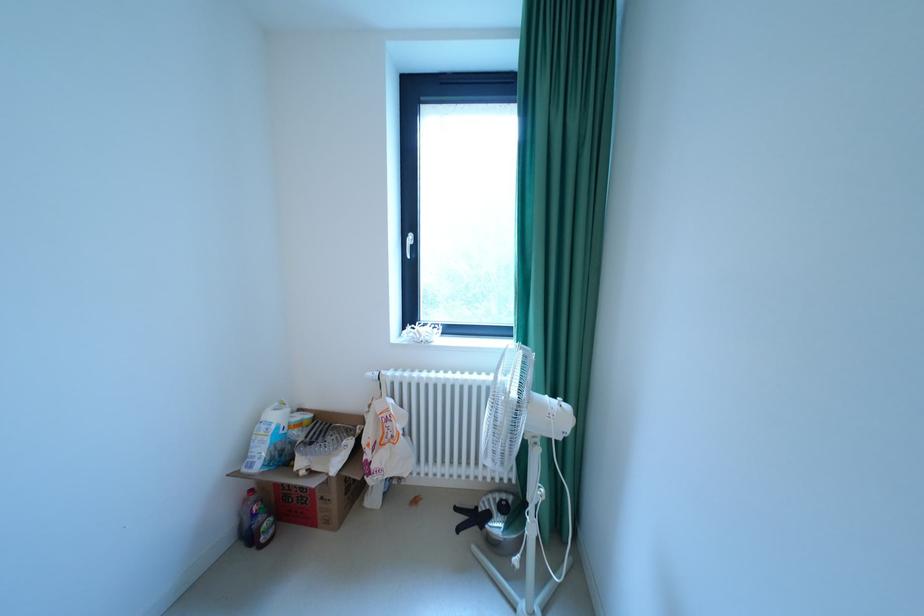
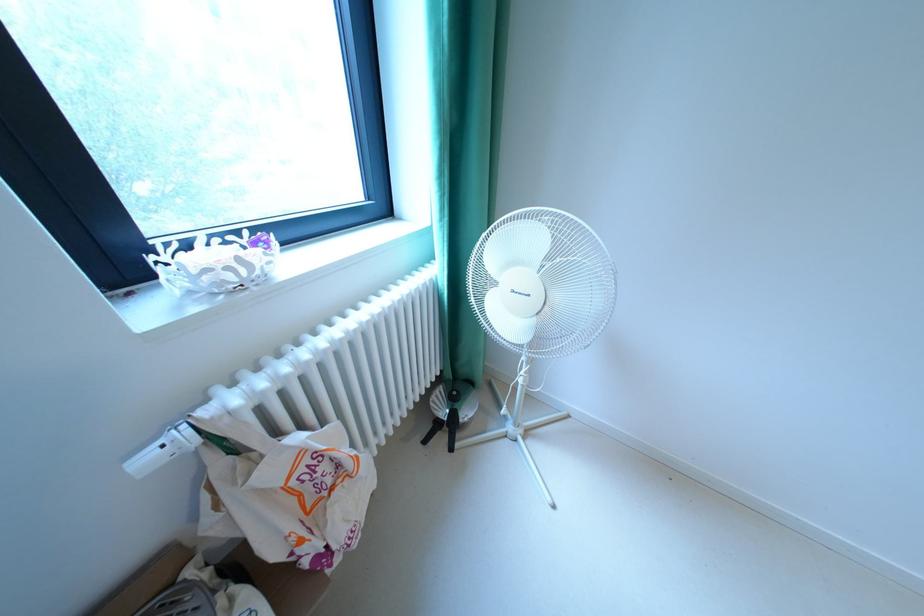
The images are taken continuously from a first-person perspective. In which direction is your viewpoint rotating?

The rotation direction of the camera is right-down.